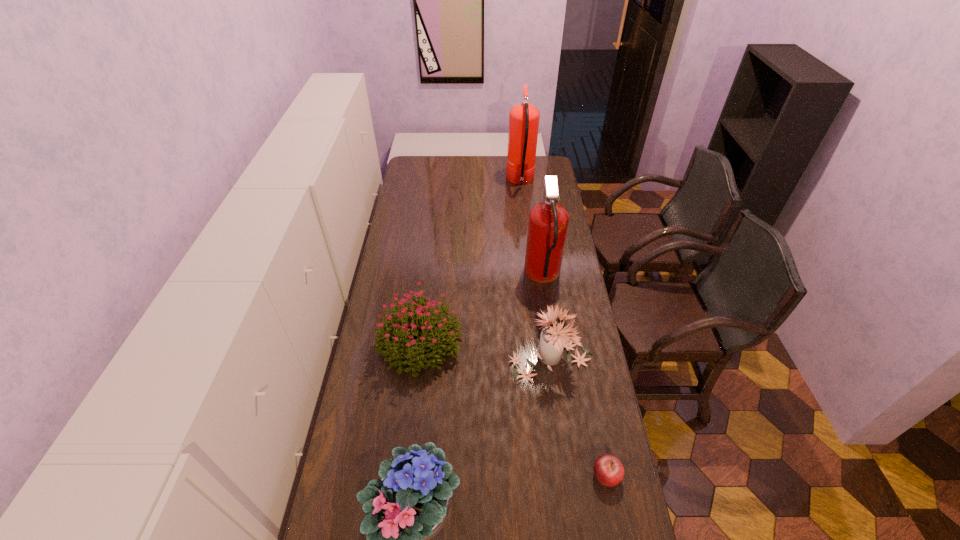
Locate an element on the screen. The width and height of the screenshot is (960, 540). free region located 0.110m on the front of the rightmost bouquet is located at coordinates (558, 415).

The image size is (960, 540). I want to click on free region located on the left of the shortest object, so click(x=472, y=475).

Find the location of a particular element. This screenshot has width=960, height=540. object at the far edge is located at coordinates (523, 118).

I want to click on object at the left edge, so [439, 331].

Locate an element on the screen. The image size is (960, 540). bouquet that is at the right edge is located at coordinates (553, 339).

At what (x,y) coordinates should I click in order to perform the action: click on apple that is at the right edge. Please return your answer as a coordinate pair (x, y). The image size is (960, 540). Looking at the image, I should click on (609, 471).

I want to click on object that is at the far right corner, so click(x=523, y=118).

Find the location of a particular element. The height and width of the screenshot is (540, 960). vacant space at the far edge of the desktop is located at coordinates (487, 167).

Where is `vacant space at the left edge of the desktop`? The width and height of the screenshot is (960, 540). vacant space at the left edge of the desktop is located at coordinates (402, 261).

The width and height of the screenshot is (960, 540). In the image, there is a desktop. What are the coordinates of `vacant space at the right edge` in the screenshot? It's located at (570, 422).